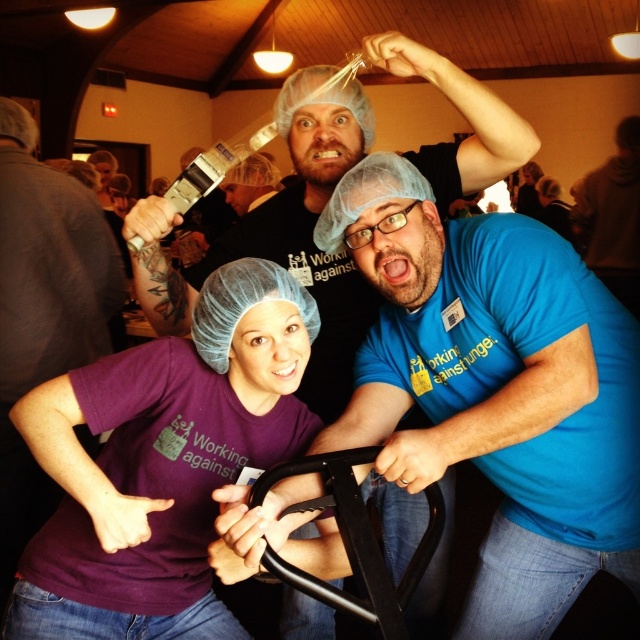
Is point (61, 509) positioned behind point (92, 273)?

No.

Is point (76, 573) positioned before point (38, 257)?

Yes.

Is point (298, 289) behind point (42, 310)?

No, (298, 289) is closer to viewer.

Locate an element on the screen. purple matte shirt at center is located at coordinates (161, 464).

The height and width of the screenshot is (640, 640). What do you see at coordinates (496, 388) in the screenshot? I see `blue matte shirt at center` at bounding box center [496, 388].

Who is more forward, (x=636, y=545) or (x=109, y=604)?

Point (x=636, y=545) is in front.

Image resolution: width=640 pixels, height=640 pixels. What do you see at coordinates (496, 388) in the screenshot?
I see `blue matte shirt at center` at bounding box center [496, 388].

Identify the location of blue matte shirt at center. This screenshot has width=640, height=640. (496, 388).

Which is more to the left, blue matte shirt at center or purple fabric shirt at left?

Positioned to the left is purple fabric shirt at left.

Is point (385, 384) behind point (20, 308)?

That is False.

Does point (538, 224) come farther from viewer compared to point (13, 529)?

That is False.

In order to click on blue matte shirt at center in this screenshot , I will do `click(496, 388)`.